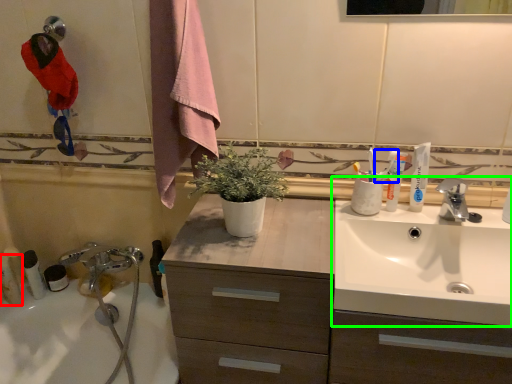
Question: Based on their relative distances, which object is nearer to toiletry (highlighted by a red box)? Choose from toothpaste (highlighted by a blue box) and sink (highlighted by a green box).

Choices:
 (A) toothpaste
 (B) sink

Answer: (A)